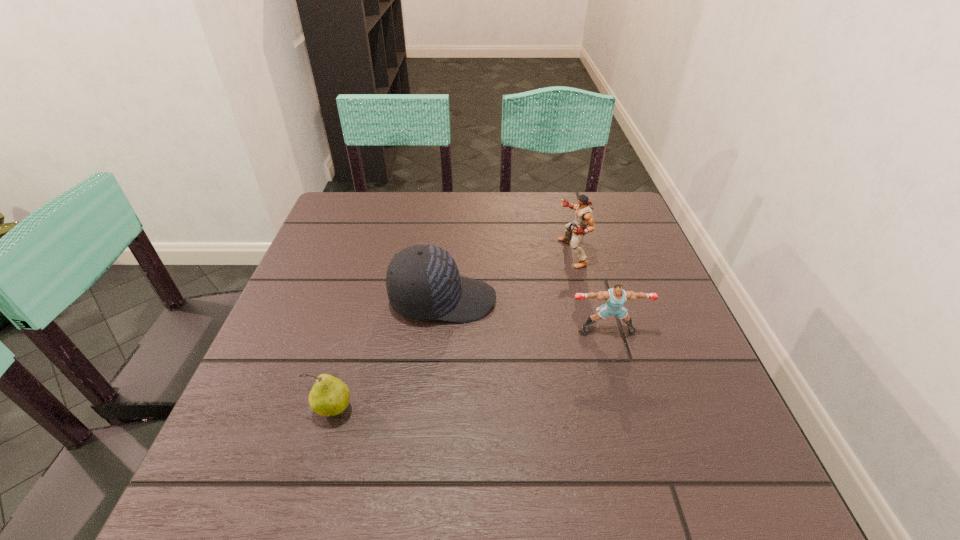
Identify the location of the farther puncher. [584, 217].

At what (x,y) coordinates should I click in order to perform the action: click on the tallest object. Please return your answer as a coordinate pair (x, y). Looking at the image, I should click on (584, 217).

The height and width of the screenshot is (540, 960). I want to click on the third object from right to left, so click(423, 282).

The image size is (960, 540). I want to click on the nearer puncher, so click(x=615, y=297).

Find the location of a particular element. This screenshot has width=960, height=540. the leftmost object is located at coordinates (329, 396).

Identify the location of pear. The image size is (960, 540). (329, 396).

Locate an element on the screen. Image resolution: width=960 pixels, height=540 pixels. vacant area located on the front-facing side of the farthest object is located at coordinates (527, 253).

You are a GUI agent. You are given a task and a screenshot of the screen. Output one action in this format:
    pyautogui.click(x=<x>, y=<y>)
    Task: Click on the free space located on the front-facing side of the farthest object
    The height and width of the screenshot is (540, 960).
    Given the screenshot: What is the action you would take?
    pyautogui.click(x=444, y=253)

Find the location of a particular element. The width and height of the screenshot is (960, 540). vacant space positioned on the front-facing side of the farthest object is located at coordinates (484, 253).

At what (x,y) coordinates should I click in order to perform the action: click on free space located at the front of the baseball cap where the brim is located. Please return your answer as a coordinate pair (x, y). Image resolution: width=960 pixels, height=540 pixels. Looking at the image, I should click on (544, 300).